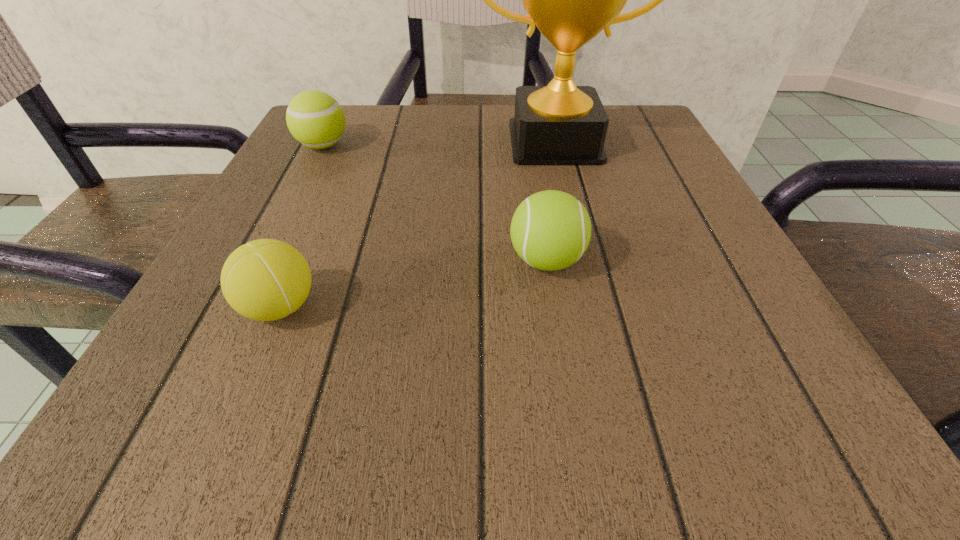
I want to click on vacant point located between the farthest tennis ball and the rightmost tennis ball, so click(435, 203).

What are the coordinates of `free space between the farthest tennis ball and the award` in the screenshot? It's located at (439, 144).

This screenshot has width=960, height=540. I want to click on blank region between the tallest object and the farthest tennis ball, so click(439, 144).

Image resolution: width=960 pixels, height=540 pixels. I want to click on object that can be found as the closest to the farthest tennis ball, so click(571, 0).

This screenshot has height=540, width=960. What are the coordinates of `object that is the third closest to the farthest tennis ball` in the screenshot? It's located at (550, 230).

Identify which tennis ball is located as the second nearest to the rightmost tennis ball. Please provide its 2D coordinates. Your answer should be formatted as a tuple, i.e. [(x, y)], where the tuple contains the x and y coordinates of a point satisfying the conditions above.

[(314, 118)]

Where is `tennis ball that is the closest one to the rightmost tennis ball`? tennis ball that is the closest one to the rightmost tennis ball is located at coordinates (266, 279).

The width and height of the screenshot is (960, 540). Find the location of `free location that satisfies the following two spatial constraints: 1. on the front side of the farthest tennis ball; 2. on the left side of the rightmost tennis ball`. free location that satisfies the following two spatial constraints: 1. on the front side of the farthest tennis ball; 2. on the left side of the rightmost tennis ball is located at coordinates (265, 260).